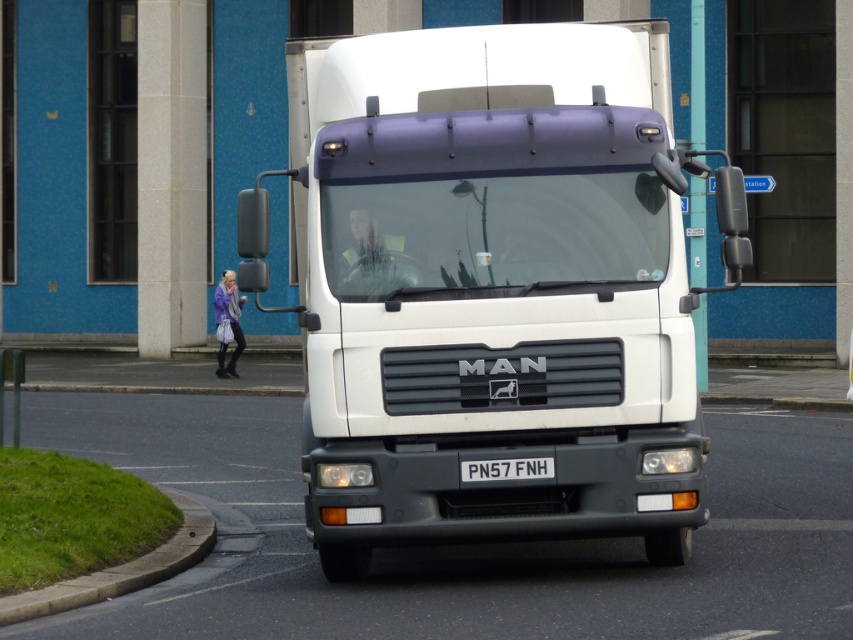
Question: Which point is closer to the camera?

Choices:
 (A) (103, 586)
 (B) (514, 477)

Answer: (B)

Question: Does white glossy trailer truck at center appear under green concrete curb at lower left?

Choices:
 (A) no
 (B) yes

Answer: (A)

Question: Does white glossy trailer truck at center have a smaller size compared to green concrete curb at lower left?

Choices:
 (A) no
 (B) yes

Answer: (A)

Question: Which of the following is the closest to the observer?

Choices:
 (A) white glossy trailer truck at center
 (B) green concrete curb at lower left
 (C) black metal license plate at center

Answer: (B)

Question: Does green concrete curb at lower left have a greater width compared to black metal license plate at center?

Choices:
 (A) no
 (B) yes

Answer: (B)

Question: Which object appears closest to the camera in this image?

Choices:
 (A) black metal license plate at center
 (B) green concrete curb at lower left
 (C) white glossy trailer truck at center

Answer: (B)